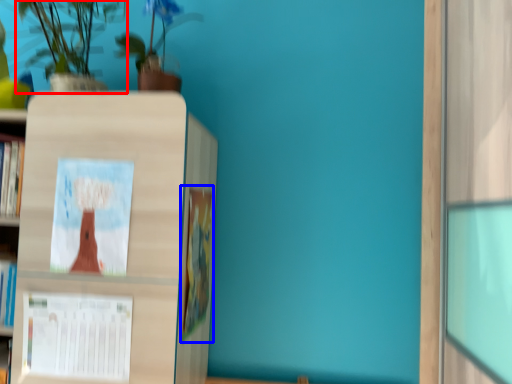
Question: Among these objects, which one is farthest to the camera, houseplant (highlighted by a red box) or book (highlighted by a blue box)?

Choices:
 (A) houseplant
 (B) book

Answer: (B)